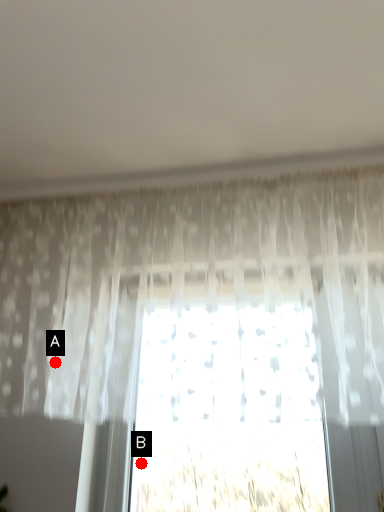
Question: Two points are circled on the image, labeled by A and B beside each circle. Which point is closer to the camera?

Choices:
 (A) A is closer
 (B) B is closer

Answer: (A)